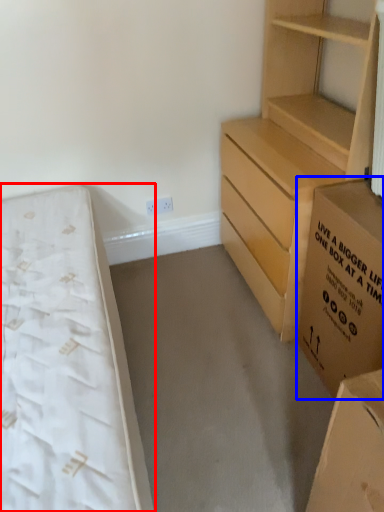
Question: Which object is further to the camera taking this photo, bed (highlighted by a red box) or cardboard box (highlighted by a blue box)?

Choices:
 (A) bed
 (B) cardboard box

Answer: (B)